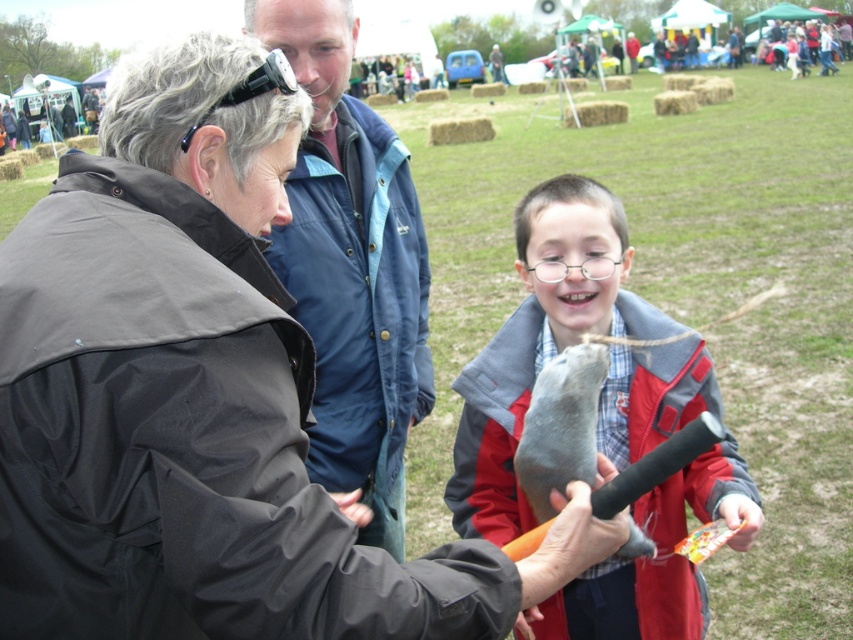
Who is higher up, matte gray plush toy at center or gray matte fish at center?

matte gray plush toy at center

Which is in front, point (598, 236) or point (585, 420)?

Point (585, 420)

The width and height of the screenshot is (853, 640). Find the location of `matte gray plush toy at center`. matte gray plush toy at center is located at coordinates (540, 340).

Where is `matte gray plush toy at center`? The image size is (853, 640). matte gray plush toy at center is located at coordinates (540, 340).

Which is above, blue fabric jacket at upper center or gray matte fish at center?

blue fabric jacket at upper center is higher up.

Is blue fabric jacket at upper center above gray matte fish at center?

Yes.

Who is more distant from viewer, (386, 260) or (583, 417)?

The point (386, 260) is more distant.

What are the coordinates of `blue fabric jacket at upper center` in the screenshot? It's located at (351, 268).

Does matte black jacket at center have a lesser width compared to gray matte fish at center?

No, matte black jacket at center is not thinner than gray matte fish at center.

What do you see at coordinates (196, 403) in the screenshot?
I see `matte black jacket at center` at bounding box center [196, 403].

This screenshot has width=853, height=640. I want to click on matte black jacket at center, so click(196, 403).

Find the location of a particular element. This screenshot has height=640, width=853. matte black jacket at center is located at coordinates click(196, 403).